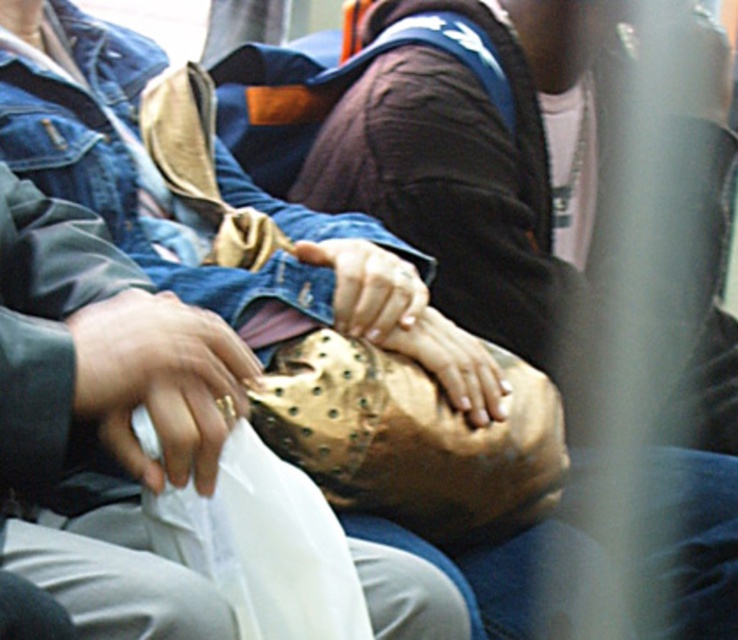
Question: Estimate the real-world distances between objects in this image. Which object is closer to the matte gold ring at center?

Choices:
 (A) matte brown leather handbag at center
 (B) gold metallic mask at center
 (C) smooth leather glove at center

Answer: (A)

Question: Which object is the farthest from the smooth leather glove at center?

Choices:
 (A) matte gold ring at center
 (B) gold metallic mask at center
 (C) matte brown leather handbag at center

Answer: (A)

Question: In this image, where is matte brown leather handbag at center located relative to smooth leather glove at center?

Choices:
 (A) above
 (B) below

Answer: (A)

Question: Which point is farther from the camera taking this photo?

Choices:
 (A) (221, 419)
 (B) (424, 314)
 (C) (714, 326)

Answer: (C)

Question: Does matte gold ring at center have a larger size compared to matte brown leather handbag at center?

Choices:
 (A) no
 (B) yes

Answer: (B)

Question: Is matte gold ring at center thinner than matte brown leather handbag at center?

Choices:
 (A) yes
 (B) no

Answer: (B)